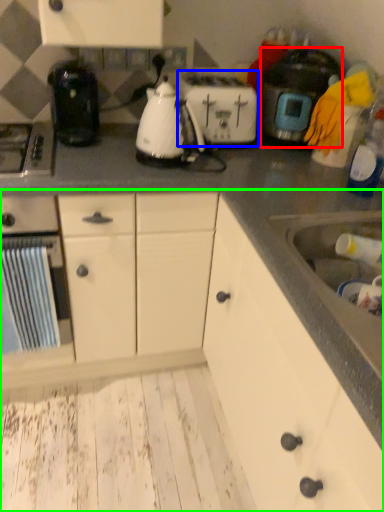
Question: Which object is the closest to the kitchen appliance (highlighted by a red box)? Choose among these: toaster (highlighted by a blue box) or cabinetry (highlighted by a green box).

Choices:
 (A) toaster
 (B) cabinetry

Answer: (A)